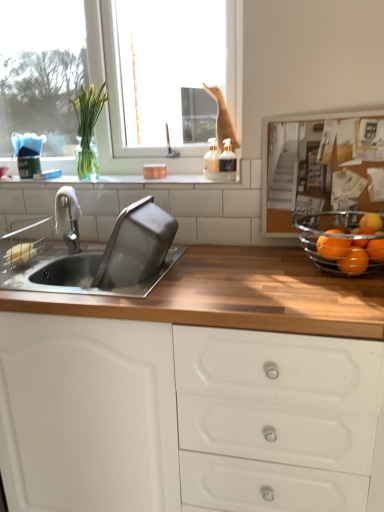
Question: Is orange matte at right, the 4th orange from the left, to the left of orange matte/orange at right, which is the 3th orange in right-to-left order, from the viewer's perspective?

Choices:
 (A) yes
 (B) no

Answer: (B)

Question: Is orange matte at right, the 4th orange from the left, not within orange matte/orange at right, which is the 3th orange in right-to-left order?

Choices:
 (A) yes
 (B) no

Answer: (A)

Question: Can orange matte/orange at right, which is the 2th orange from left to right, be found inside orange matte at right, the 4th orange from the left?

Choices:
 (A) no
 (B) yes

Answer: (A)

Question: Is orange matte at right, which is the first orange from right to left, turned away from orange matte/orange at right, which is the 2th orange from left to right?

Choices:
 (A) no
 (B) yes

Answer: (A)

Question: Is the depth of orange matte at right, which is the first orange from right to left, less than that of orange matte/orange at right, which is the 2th orange from left to right?

Choices:
 (A) yes
 (B) no

Answer: (B)

Question: From the image's perspective, is clear glass bowl at right above or below white tile at upper center?

Choices:
 (A) above
 (B) below

Answer: (B)

Question: Considering the positions of point (334, 245) and point (183, 182), is point (334, 245) closer or farther from the camera than point (183, 182)?

Choices:
 (A) farther
 (B) closer

Answer: (B)

Question: Is clear glass bowl at right in front of or behind white tile at upper center in the image?

Choices:
 (A) front
 (B) behind

Answer: (A)

Question: Is clear glass bowl at right inside the boundaries of white tile at upper center, or outside?

Choices:
 (A) outside
 (B) inside

Answer: (A)

Question: In the image, is clear glass window at upper left on the left side or the right side of green glass vase at upper left?

Choices:
 (A) left
 (B) right

Answer: (B)

Question: Considering the positions of clear glass window at upper left and green glass vase at upper left in the image, is clear glass window at upper left wider or thinner than green glass vase at upper left?

Choices:
 (A) wide
 (B) thin

Answer: (B)

Question: In the image, is clear glass window at upper left positioned in front of or behind green glass vase at upper left?

Choices:
 (A) front
 (B) behind

Answer: (A)

Question: From the image's perspective, is clear glass window at upper left located above or below green glass vase at upper left?

Choices:
 (A) above
 (B) below

Answer: (A)

Question: Is orange matte at right, which is the first orange from right to left, bigger or smaller than clear glass window at upper left?

Choices:
 (A) big
 (B) small

Answer: (B)

Question: Is orange matte at right, which is the first orange from right to left, wider or thinner than clear glass window at upper left?

Choices:
 (A) wide
 (B) thin

Answer: (B)